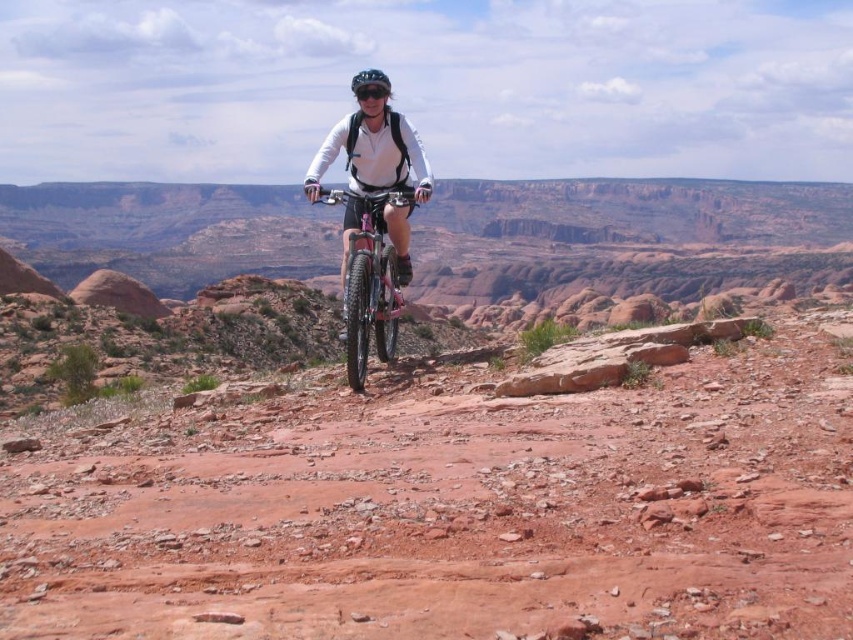
You are navigating a mountain bike through the desert trail shown. You notice two points on your GPS. The first point is at coordinate point (384, 332) and the second point is at coordinate point (358, 72). Which point should you head towards first to stay on the correct path?

You should head towards point (358, 72) first because point (384, 332) is in front of it, meaning point (358, 72) is behind and thus the starting point on the correct path.